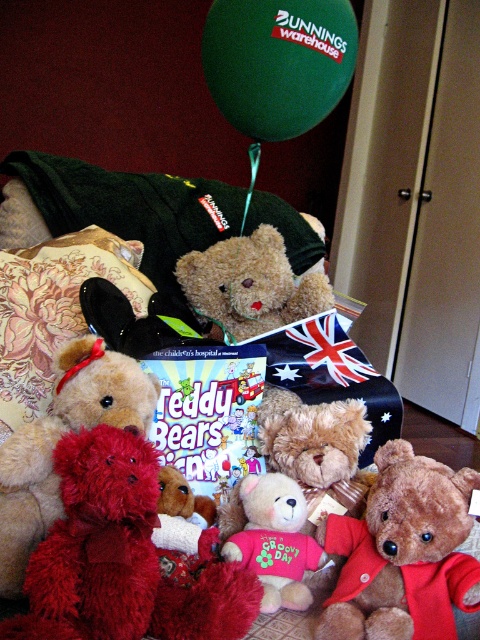
Question: Which object is positioned closest to the green matte balloon at upper center?

Choices:
 (A) velvet floral pillow at center
 (B) fluffy brown teddy bear at center
 (C) velvety brown teddy bear at center
 (D) fluffy pink teddy bear at center

Answer: (A)

Question: Is velvet floral pillow at center to the left of fuzzy brown teddy bear at center from the viewer's perspective?

Choices:
 (A) no
 (B) yes

Answer: (B)

Question: Which point is farther to the camera?

Choices:
 (A) fluffy brown teddy bear at center
 (B) velvet floral pillow at center
 (C) velvety red teddy bear at center

Answer: (B)

Question: Does green matte balloon at upper center appear under velvety red teddy bear at center?

Choices:
 (A) no
 (B) yes

Answer: (A)

Question: Is velvet floral pillow at center smaller than fuzzy brown teddy bear at center?

Choices:
 (A) no
 (B) yes

Answer: (B)

Question: Which point appears closest to the camera in this image?

Choices:
 (A) (259, 522)
 (B) (336, 419)
 (C) (111, 282)
 (D) (264, 131)

Answer: (A)